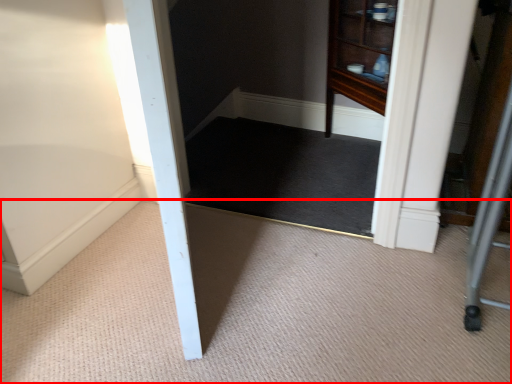
Question: Observing the image, what is the correct spatial positioning of plain (annotated by the red box) in reference to mat?

Choices:
 (A) right
 (B) left

Answer: (B)